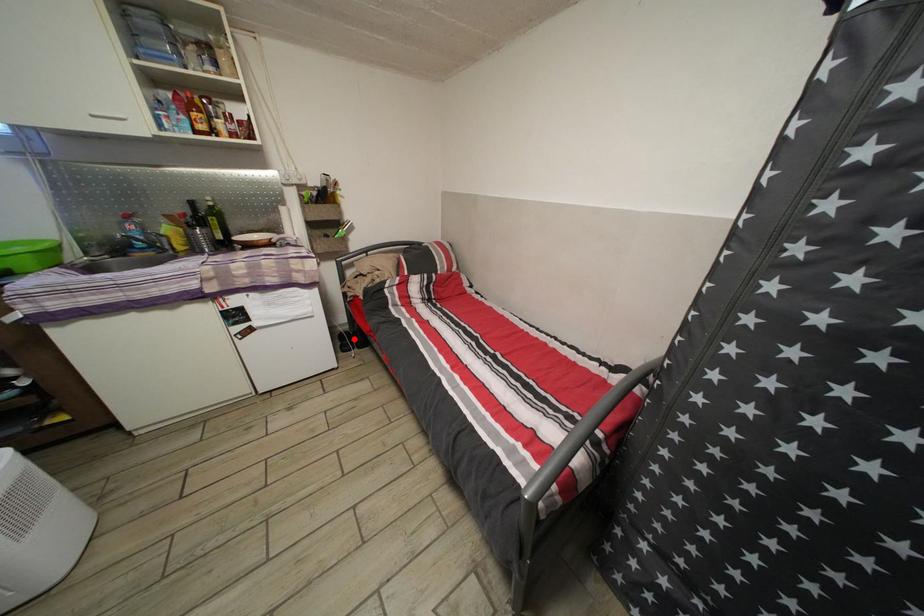
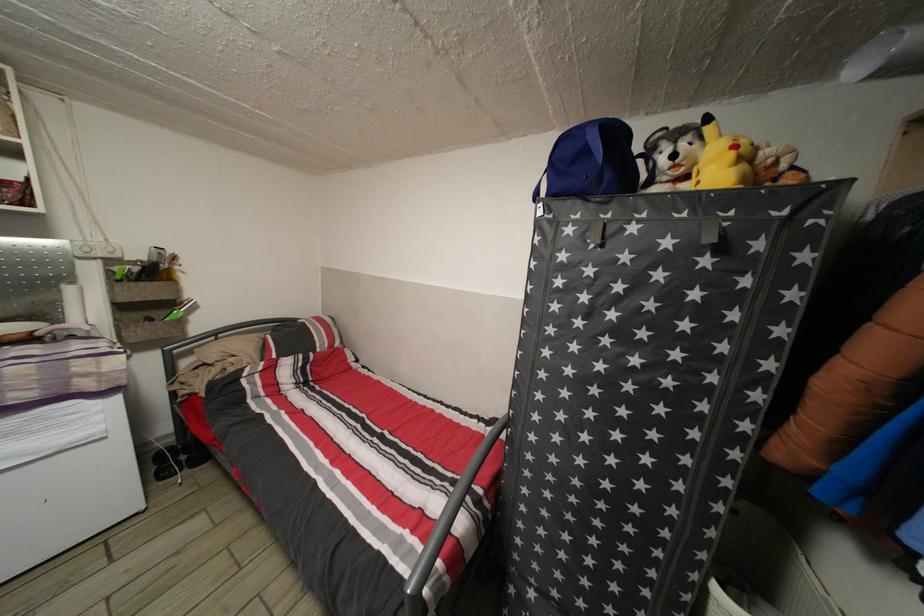
Question: I am providing you with two images of the same scene from different viewpoints. A red point is shown in image1. For the corresponding object point in image2, is it positioned nearer or farther from the camera?

Choices:
 (A) Nearer
 (B) Farther

Answer: (A)